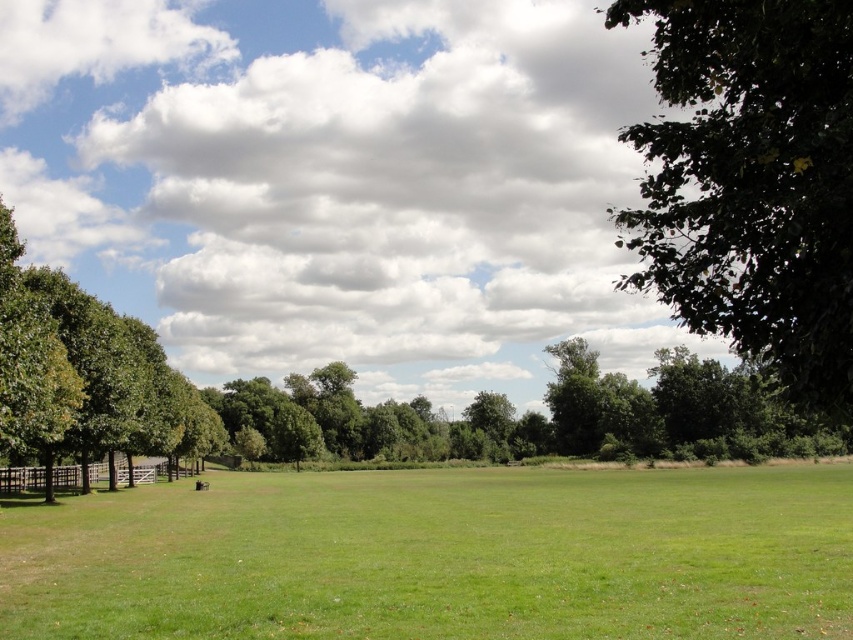
Can you confirm if green grassy field at center is bigger than green leafy tree at upper right?

Actually, green grassy field at center might be smaller than green leafy tree at upper right.

This screenshot has height=640, width=853. Describe the element at coordinates (440, 556) in the screenshot. I see `green grassy field at center` at that location.

The width and height of the screenshot is (853, 640). Find the location of `green grassy field at center`. green grassy field at center is located at coordinates (440, 556).

I want to click on green grassy field at center, so click(x=440, y=556).